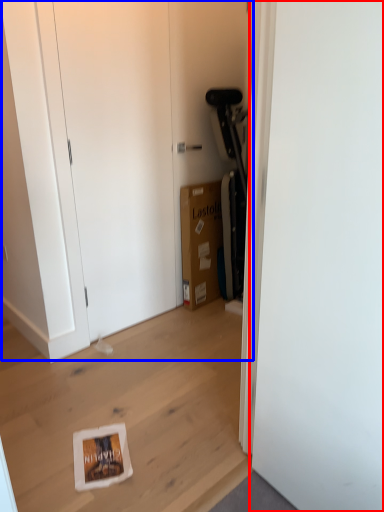
Question: Which object appears farthest to the camera in this image, door (highlighted by a red box) or dresser (highlighted by a blue box)?

Choices:
 (A) door
 (B) dresser

Answer: (B)